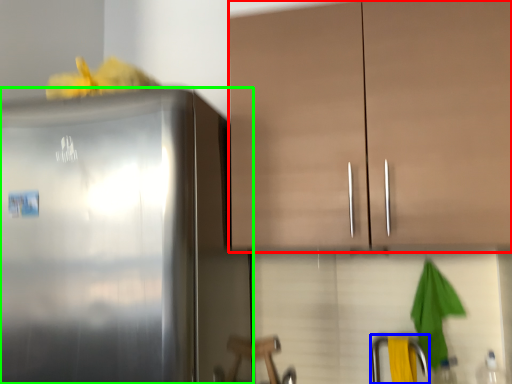
Question: Considering the real-world distances, which object is closest to cabinetry (highlighted by a red box)? faucet (highlighted by a blue box) or refrigerator (highlighted by a green box).

Choices:
 (A) faucet
 (B) refrigerator

Answer: (B)